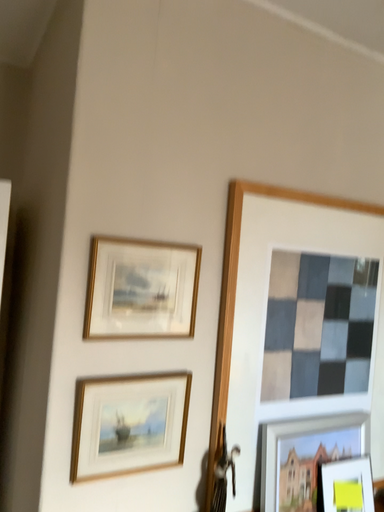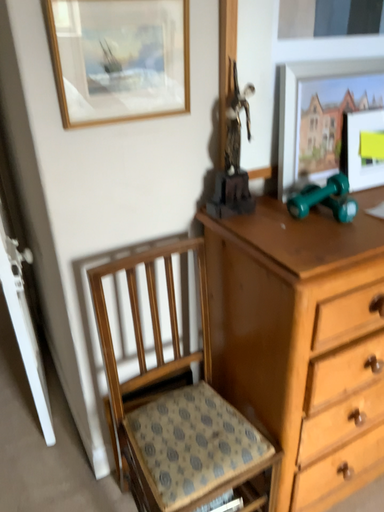
Question: Which way did the camera rotate in the video?

Choices:
 (A) rotated downward
 (B) rotated upward

Answer: (A)